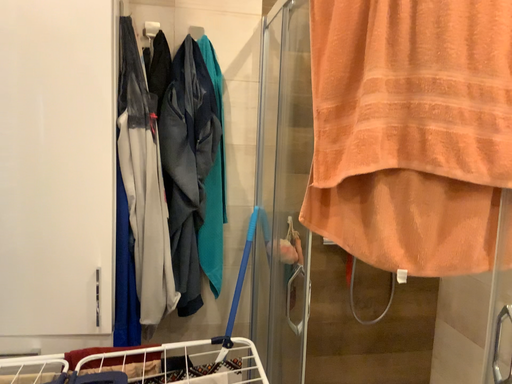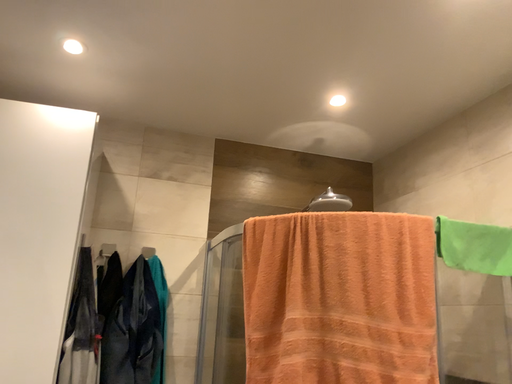
Question: How did the camera likely rotate when shooting the video?

Choices:
 (A) rotated downward
 (B) rotated upward

Answer: (B)